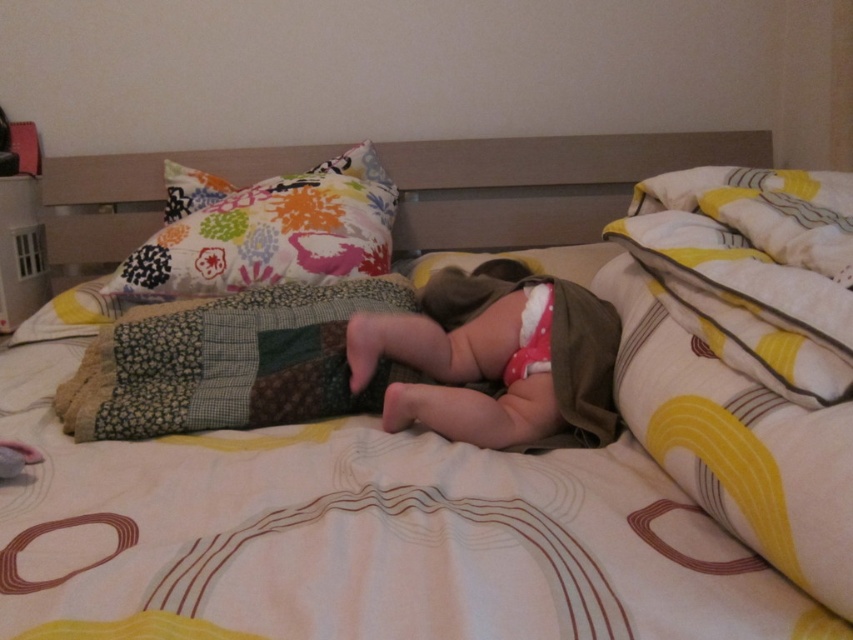
You are a parent trying to place the pink fabric diaper at center on top of the multicolored fabric pillow at upper left. Will the diaper fit entirely on the pillow without hanging off the edges?

The pink fabric diaper at center has a lesser width compared to the multicolored fabric pillow at upper left, so the diaper will fit entirely on the pillow without hanging off the edges.

You are a parent checking on your baby in the bedroom. You see the multicolored fabric pillow at upper left and the white soft diaper at center. Which object is closer to you?

The multicolored fabric pillow at upper left is closer to you because the white soft diaper at center is behind it.

You are a parent trying to choose between the pink fabric diaper at center and the white soft diaper at center for your baby. Based on the size, which one would you pick if you want the larger one?

The pink fabric diaper at center is bigger than the white soft diaper at center, so you should choose the pink fabric diaper at center if you want the larger one.